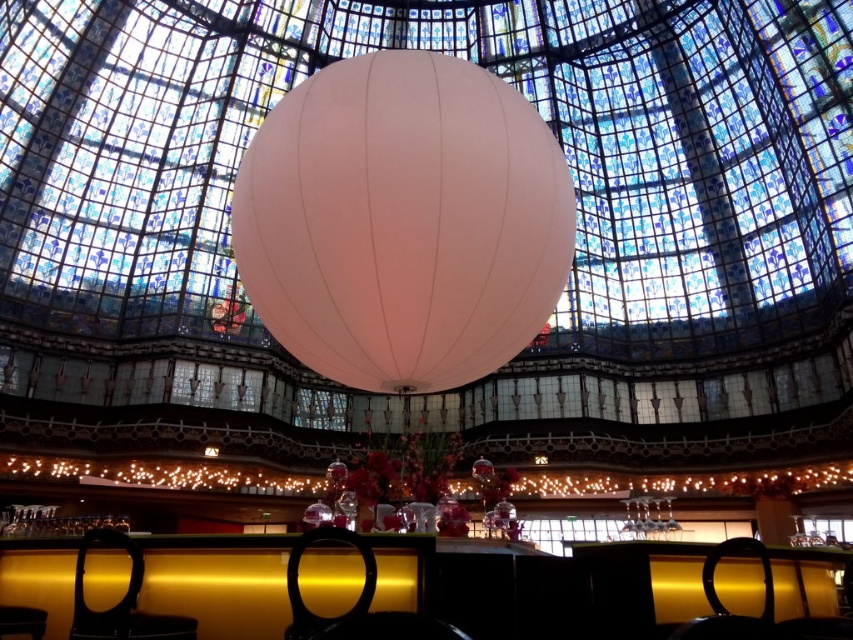
Is point (511, 145) farther from viewer compared to point (770, 627)?

Yes, it is behind point (770, 627).

What do you see at coordinates (403, 221) in the screenshot?
I see `white matte balloon at center` at bounding box center [403, 221].

This screenshot has width=853, height=640. Find the location of `white matte balloon at center`. white matte balloon at center is located at coordinates (403, 221).

Can you confirm if white matte balloon at center is positioned to the left of black leather chair at lower left?

No, white matte balloon at center is not to the left of black leather chair at lower left.

Who is lower down, white matte balloon at center or black leather chair at lower left?

black leather chair at lower left

This screenshot has width=853, height=640. I want to click on white matte balloon at center, so click(x=403, y=221).

Who is higher up, gold metallic table at lower center or black leather chair at lower left?

gold metallic table at lower center

Is gold metallic table at lower center above black leather chair at lower left?

Yes.

From the picture: Who is more distant from viewer, (654, 564) or (102, 627)?

Positioned behind is point (654, 564).

Find the location of a particular element. Image resolution: width=853 pixels, height=640 pixels. gold metallic table at lower center is located at coordinates (647, 579).